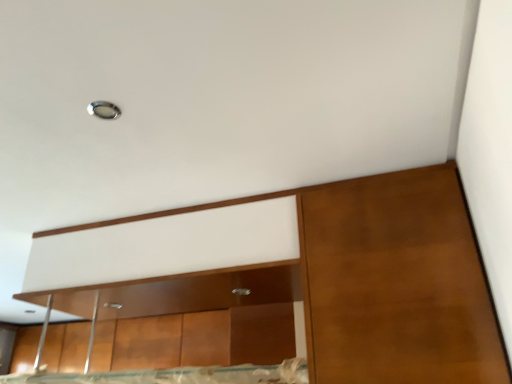
The height and width of the screenshot is (384, 512). What do you see at coordinates (193, 318) in the screenshot?
I see `wooden cabinet at center` at bounding box center [193, 318].

Identify the location of wooden cabinet at center. (193, 318).

In order to face wooden cabinet at center, should I rotate leftwards or rightwards?

Rotate left and turn 11.247 degrees.

What are the coordinates of `wooden cabinet at center` in the screenshot? It's located at (193, 318).